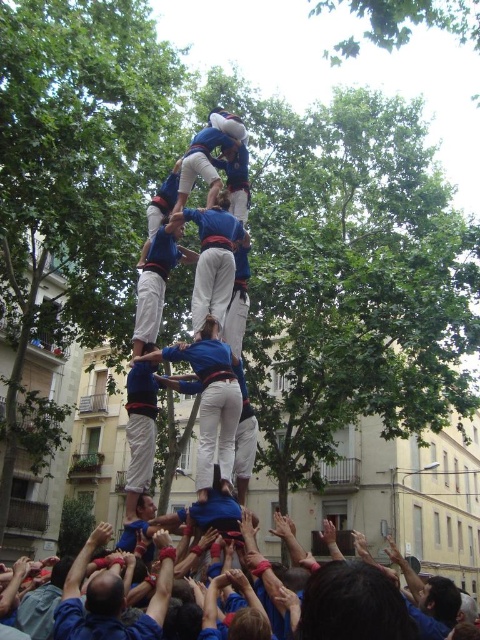
You are a photographer at the event and want to capture the human tower. You notice the blue fabric human at center and the blue fabric hands at lower center. Which one appears taller in the photo?

The blue fabric human at center appears taller than the blue fabric hands at lower center because it has a greater height compared to the latter.

You are a participant in the castell event and you see the blue fabric human at center and the blue fabric hands at lower center. Which object is located to the right of the other?

The blue fabric human at center is positioned on the right side of blue fabric hands at lower center.

You are a photographer trying to capture the human tower in the image. You notice the blue fabric human at center and the blue fabric hands at lower center. Which one should you zoom in on to focus on the main structure of the tower?

The blue fabric human at center is larger in size than the blue fabric hands at lower center, so focusing on the blue fabric human at center would better highlight the main structure of the tower since it is the larger component.